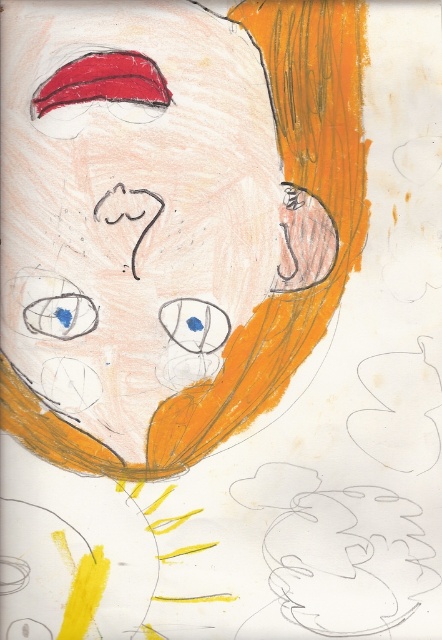
What do you see at coordinates (194, 324) in the screenshot?
I see `blue matte eye at center` at bounding box center [194, 324].

The width and height of the screenshot is (442, 640). What are the coordinates of `blue matte eye at center` in the screenshot? It's located at (194, 324).

Identify the location of blue matte eye at center. (194, 324).

Locate an element on the screen. This screenshot has width=442, height=640. blue matte eye at center is located at coordinates (194, 324).

Is point (15, 211) farther from viewer compared to point (163, 301)?

No, (15, 211) is closer to viewer.

Is matte orange hair at upper right wider than blue matte eye at center?

Correct, the width of matte orange hair at upper right exceeds that of blue matte eye at center.

Is point (178, 29) more distant than point (221, 321)?

That is False.

Identify the location of matte orange hair at upper right. (130, 198).

Based on the photo, is matte orange hair at upper right to the right of blue matte eye at upper left from the viewer's perspective?

Indeed, matte orange hair at upper right is positioned on the right side of blue matte eye at upper left.

Between matte orange hair at upper right and blue matte eye at upper left, which one is positioned lower?

blue matte eye at upper left is below.

Is point (255, 58) behind point (23, 321)?

No.

Find the location of a particular element. This screenshot has width=442, height=640. matte orange hair at upper right is located at coordinates point(130,198).